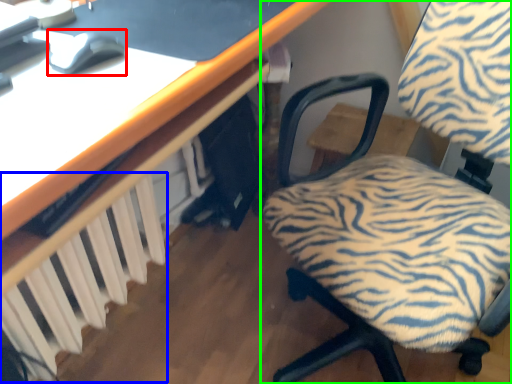
Question: Estimate the real-world distances between objects in this image. Which object is closer to mouse (highlighted by a red box), radiator (highlighted by a blue box) or chair (highlighted by a green box)?

Choices:
 (A) radiator
 (B) chair

Answer: (A)